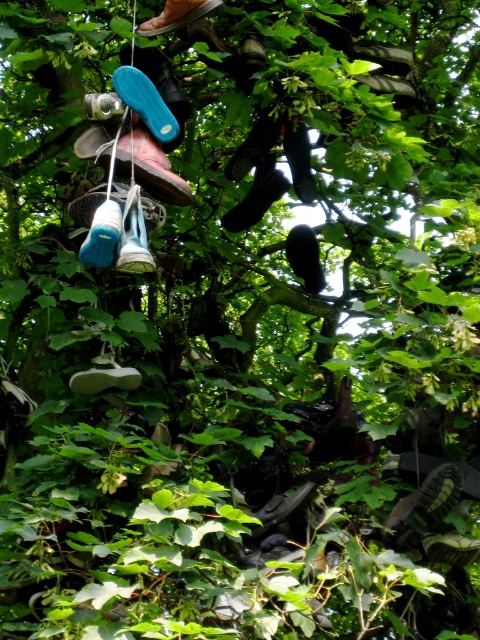
Question: Considering the relative positions of blue suede shoe at center and white matte shoe at center in the image provided, where is blue suede shoe at center located with respect to white matte shoe at center?

Choices:
 (A) below
 (B) above

Answer: (B)

Question: Considering the real-world distances, which object is closest to the blue suede shoe at upper left?

Choices:
 (A) blue suede shoe at center
 (B) blue rubber shoe at upper center

Answer: (A)

Question: Which of the following is the closest to the observer?

Choices:
 (A) white matte shoe at center
 (B) blue suede shoe at upper left
 (C) blue rubber shoe at upper center
 (D) blue suede shoe at center

Answer: (D)

Question: Which object is positioned closest to the blue suede shoe at upper left?

Choices:
 (A) blue rubber shoe at upper center
 (B) white matte shoe at center
 (C) blue suede shoe at center

Answer: (C)

Question: Is blue suede shoe at center bigger than white matte shoe at center?

Choices:
 (A) no
 (B) yes

Answer: (B)

Question: Is white matte shoe at center to the right of blue rubber shoe at upper center from the viewer's perspective?

Choices:
 (A) yes
 (B) no

Answer: (B)